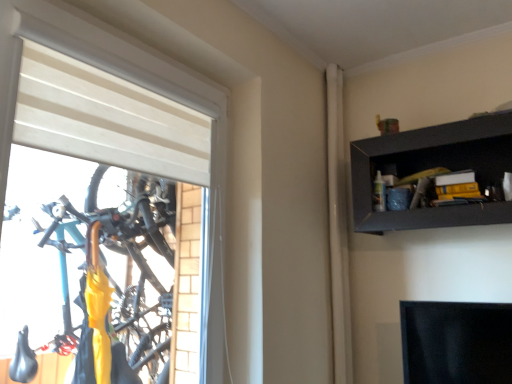
Where is `white matte window at left`? This screenshot has width=512, height=384. white matte window at left is located at coordinates (127, 81).

I want to click on white matte window at left, so click(127, 81).

Can you see white matte window at left touching white matte curtain at upper right?

white matte window at left and white matte curtain at upper right are not in contact.

Which is closer to the camera, (12, 78) or (337, 342)?

Point (12, 78).

From the image's perspective, is white matte window at left located above or below white matte curtain at upper right?

From the image's perspective, white matte window at left appears above white matte curtain at upper right.

Is white matte window at left wider or thinner than white matte curtain at upper right?

Clearly, white matte window at left has more width compared to white matte curtain at upper right.

How many degrees apart are the facing directions of white matte curtain at upper right and white matte window at left?

The angular difference between white matte curtain at upper right and white matte window at left is 0.366 degrees.

Is white matte curtain at upper right positioned with its back to white matte window at left?

No, white matte window at left is not at the back of white matte curtain at upper right.

Which is in front, white matte curtain at upper right or white matte window at left?

Positioned in front is white matte window at left.

Measure the distance between white matte curtain at upper right and white matte window at left.

white matte curtain at upper right is 33.93 inches away from white matte window at left.

Is white matte window at left thinner than black matte shelf at upper right?

Correct, the width of white matte window at left is less than that of black matte shelf at upper right.

From a real-world perspective, is white matte window at left over black matte shelf at upper right?

No.

Between white matte window at left and black matte shelf at upper right, which one has smaller size?

black matte shelf at upper right.

Image resolution: width=512 pixels, height=384 pixels. Find the location of `window that appears in front of the black matte shelf at upper right`. window that appears in front of the black matte shelf at upper right is located at coordinates (127, 81).

Is point (334, 179) more distant than point (482, 157)?

Yes, it is behind point (482, 157).

Is white matte curtain at upper right bigger than black matte shelf at upper right?

Actually, white matte curtain at upper right might be smaller than black matte shelf at upper right.

Are white matte curtain at upper right and black matte shelf at upper right making contact?

No, white matte curtain at upper right is not with black matte shelf at upper right.

Considering the sizes of black matte shelf at upper right and white matte curtain at upper right in the image, is black matte shelf at upper right bigger or smaller than white matte curtain at upper right?

black matte shelf at upper right is bigger than white matte curtain at upper right.

In the scene shown: Is black matte shelf at upper right in front of white matte curtain at upper right?

Yes, it is.

Measure the distance between black matte shelf at upper right and white matte curtain at upper right.

16.41 inches.

Considering the relative positions of black matte shelf at upper right and white matte curtain at upper right in the image provided, is black matte shelf at upper right to the left of white matte curtain at upper right from the viewer's perspective?

No, black matte shelf at upper right is not to the left of white matte curtain at upper right.

Considering the relative positions of black matte shelf at upper right and white matte window at left in the image provided, is black matte shelf at upper right to the left or to the right of white matte window at left?

Clearly, black matte shelf at upper right is on the right of white matte window at left in the image.

From the image's perspective, who appears lower, black matte shelf at upper right or white matte window at left?

white matte window at left.

In the scene shown: From a real-world perspective, is black matte shelf at upper right positioned above or below white matte window at left?

black matte shelf at upper right is situated higher than white matte window at left in the real world.

Is black matte shelf at upper right outside of white matte window at left?

black matte shelf at upper right lies outside white matte window at left's area.

You are a GUI agent. You are given a task and a screenshot of the screen. Output one action in this format:
    pyautogui.click(x=<x>, y=<y>)
    Task: Click on the curtain behind the white matte window at left
    This screenshot has width=512, height=384.
    Given the screenshot: What is the action you would take?
    pyautogui.click(x=338, y=227)

Identify the location of window in front of the white matte curtain at upper right. The height and width of the screenshot is (384, 512). (127, 81).

Estimate the real-world distances between objects in this image. Which object is closer to black matte shelf at upper right, white matte curtain at upper right or white matte window at left?

Among the two, white matte curtain at upper right is located nearer to black matte shelf at upper right.

Considering their positions, is white matte window at left positioned closer to black matte shelf at upper right than white matte curtain at upper right?

white matte curtain at upper right.

When comparing their distances from white matte curtain at upper right, does black matte shelf at upper right or white matte window at left seem further?

white matte window at left.

Based on their spatial positions, is white matte curtain at upper right or black matte shelf at upper right further from white matte window at left?

white matte curtain at upper right is positioned further to the anchor white matte window at left.

Looking at the image, which one is located closer to white matte window at left, black matte shelf at upper right or white matte curtain at upper right?

black matte shelf at upper right is positioned closer to the anchor white matte window at left.

When comparing their distances from white matte curtain at upper right, does white matte window at left or black matte shelf at upper right seem closer?

black matte shelf at upper right is positioned closer to the anchor white matte curtain at upper right.

Identify the location of shelf located between white matte window at left and white matte curtain at upper right in the depth direction. The width and height of the screenshot is (512, 384). (433, 167).